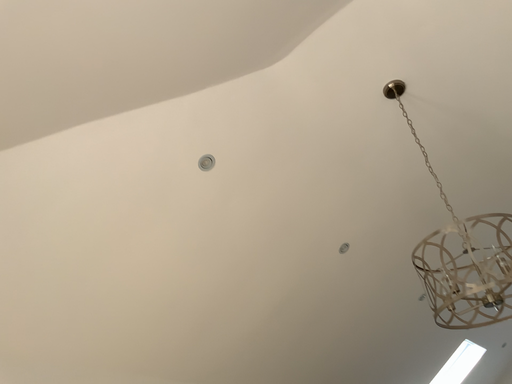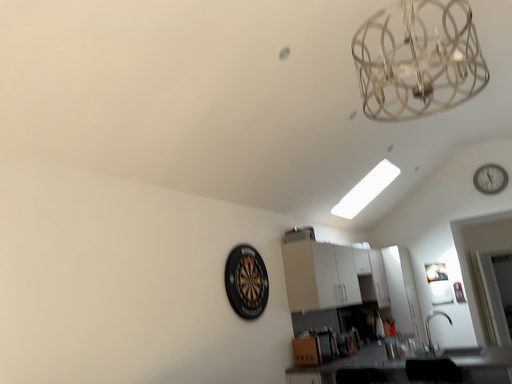
Question: How did the camera likely rotate when shooting the video?

Choices:
 (A) rotated right
 (B) rotated left

Answer: (A)